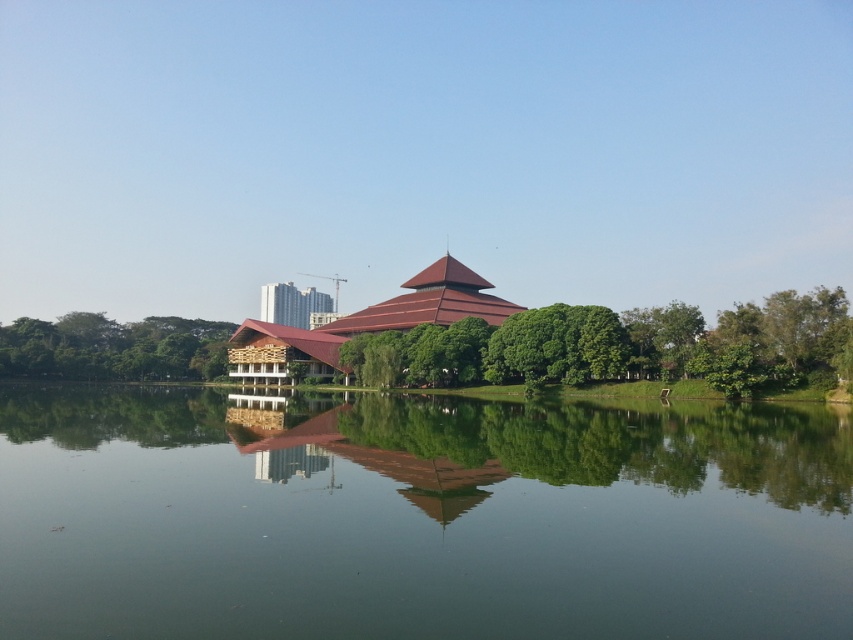
Question: Which point is closer to the camera?

Choices:
 (A) (4, 362)
 (B) (599, 336)
 (C) (460, 509)
 (D) (286, 289)

Answer: (C)

Question: Is transparent water at center thinner than green leafy tree at center?

Choices:
 (A) yes
 (B) no

Answer: (B)

Question: Which object is positioned farthest from the green leafy tree at left?

Choices:
 (A) green leafy tree at center
 (B) matte brown temple at center
 (C) metallic glass building at center

Answer: (C)

Question: In this image, where is transparent water at center located relative to green leafy tree at center?

Choices:
 (A) below
 (B) above

Answer: (A)

Question: Where is green leafy tree at center located in relation to green leafy tree at left in the image?

Choices:
 (A) left
 (B) right

Answer: (B)

Question: Among these points, which one is nearest to the camera?

Choices:
 (A) (538, 483)
 (B) (268, 304)
 (C) (492, 285)

Answer: (A)